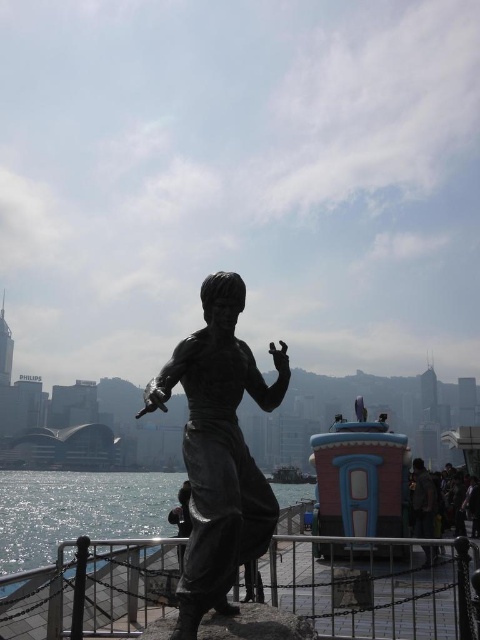
You are a photographer planning to capture the statue and the waterfront in one frame. Given that the bronze statue at center and the glistening silver water at center are both in your shot, which object occupies a narrower width in the image?

The bronze statue at center is thinner than the glistening silver water at center, so the bronze statue at center occupies a narrower width in the image.